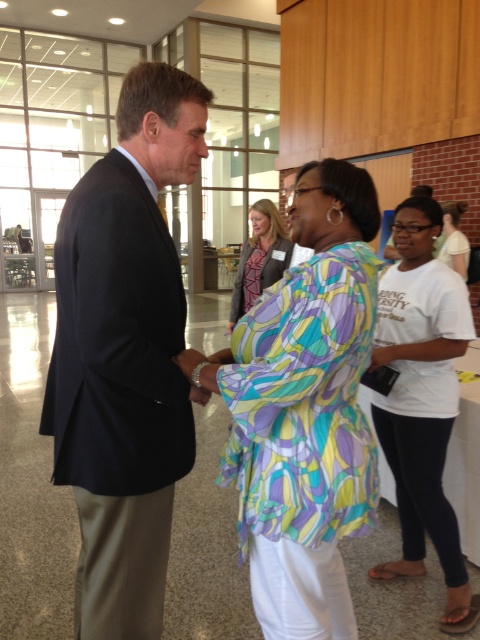
Question: Can you confirm if black suit at left is smaller than printed fabric blouse at center?

Choices:
 (A) yes
 (B) no

Answer: (B)

Question: In this image, where is black suit at left located relative to white cotton t-shirt at right?

Choices:
 (A) below
 (B) above

Answer: (B)

Question: Which object is farther from the camera taking this photo?

Choices:
 (A) multicolored fabric blouse at center
 (B) printed fabric blouse at center
 (C) black suit at left
 (D) white cotton t-shirt at right

Answer: (B)

Question: Which point is closer to the camera?

Choices:
 (A) multicolored fabric blouse at center
 (B) black suit at left
 (C) printed fabric blouse at center

Answer: (A)

Question: Among these objects, which one is nearest to the camera?

Choices:
 (A) white cotton t-shirt at right
 (B) multicolored fabric blouse at center
 (C) white cotton shirt at upper right
 (D) printed fabric blouse at center

Answer: (B)

Question: Where is multicolored fabric blouse at center located in relation to white cotton t-shirt at right in the image?

Choices:
 (A) above
 (B) below

Answer: (A)